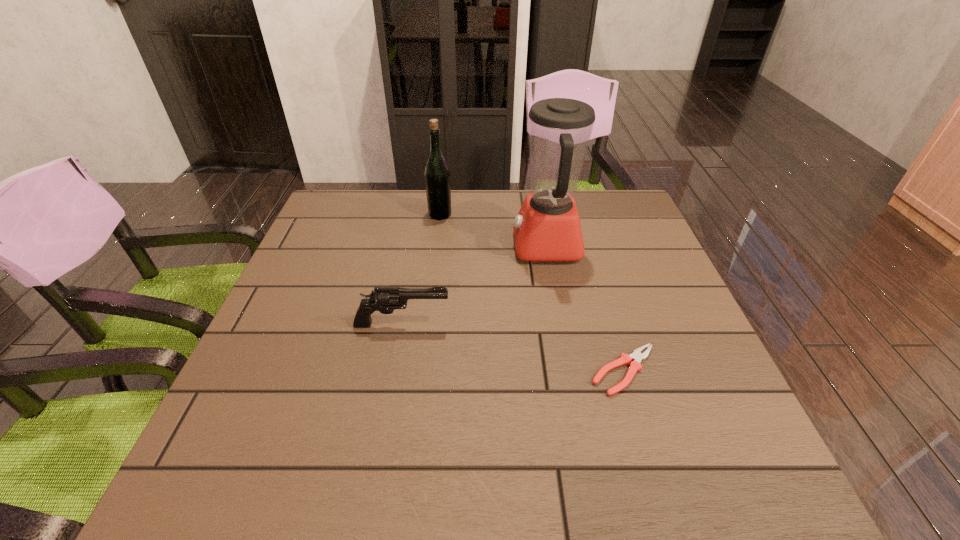
At what (x,y) coordinates should I click in order to perform the action: click on free space located 0.110m on the front of the tallest object near the controls. Please return your answer as a coordinate pair (x, y). This screenshot has width=960, height=540. Looking at the image, I should click on (472, 246).

Where is `vacant area located on the right of the third shortest object`? The width and height of the screenshot is (960, 540). vacant area located on the right of the third shortest object is located at coordinates (509, 214).

Where is `vacant region located at the end of the barrel of the gun`? vacant region located at the end of the barrel of the gun is located at coordinates (598, 325).

At what (x,y) coordinates should I click in order to perform the action: click on blank space located 0.180m on the front of the nearest object. Please return your answer as a coordinate pair (x, y). Looking at the image, I should click on (661, 495).

Where is `blender at the far edge`? blender at the far edge is located at coordinates (547, 228).

Locate an element on the screen. This screenshot has width=960, height=540. beer bottle present at the far edge is located at coordinates (437, 176).

Find the location of a particular element. object situated at the right edge is located at coordinates (635, 365).

Identify the location of free space at the near edge of the desktop. Image resolution: width=960 pixels, height=540 pixels. (484, 479).

Locate an element on the screen. This screenshot has height=540, width=960. vacant space at the left edge is located at coordinates (301, 391).

This screenshot has height=540, width=960. In the image, there is a desktop. What are the coordinates of `vacant space at the far right corner` in the screenshot? It's located at (582, 191).